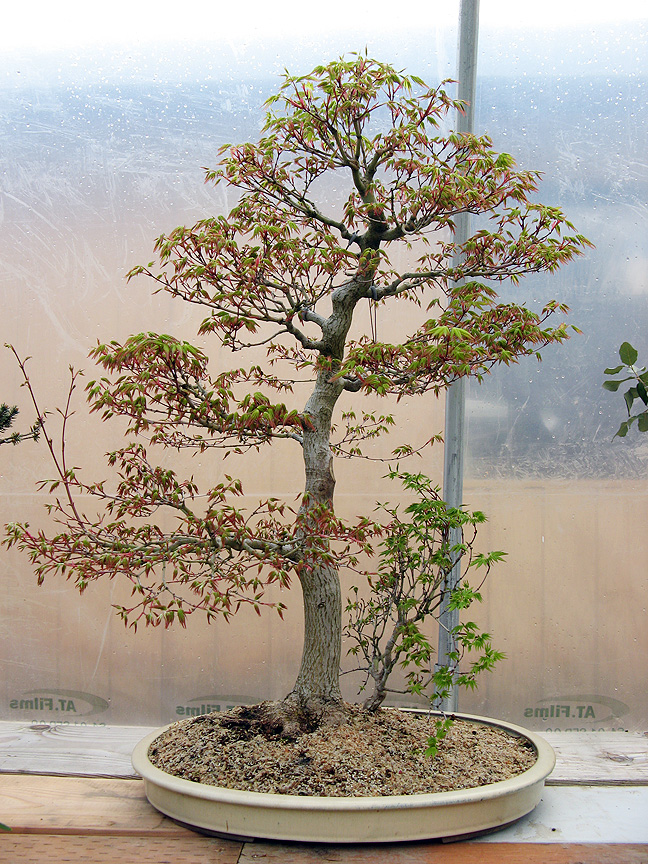
What are the coordinates of `bonsai tree trunk` in the screenshot? It's located at (308, 473).